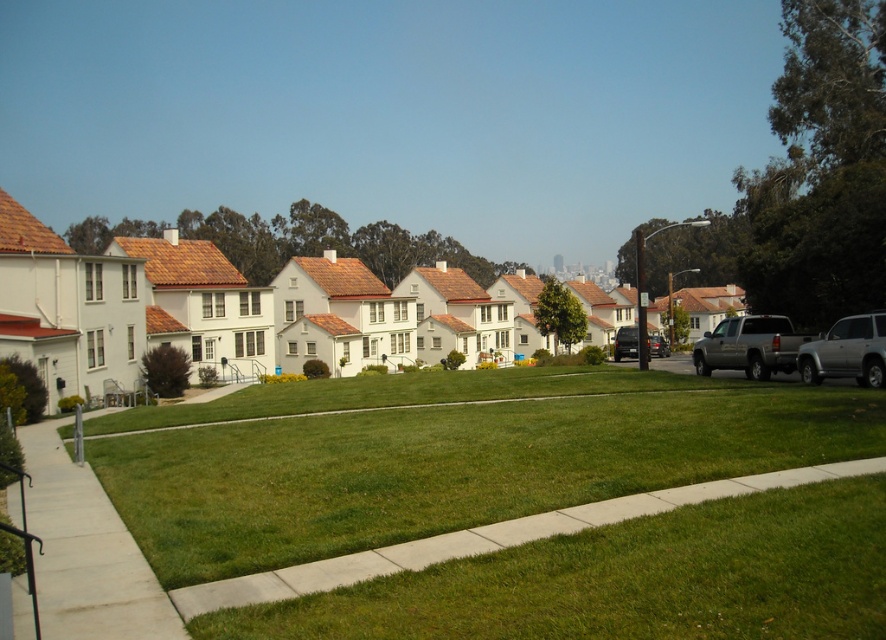
You are standing at the point with coordinates (750, 346) in the image. What object is located at that point?

The point (750, 346) corresponds to the silver metallic truck at right.

You are a delivery person standing on the gray concrete sidewalk at lower left and need to reach the silver metallic truck at right. Which direction should you move to get closer to the truck?

Since the gray concrete sidewalk at lower left is closer to the viewer than the silver metallic truck at right, you should move forward in the direction towards the truck to get closer to it.

You are a delivery driver who needs to park your vehicle in the suburban neighborhood. You see a silver metallic truck at right and a silver metallic suv at right. Which vehicle is positioned higher up in the image?

The silver metallic truck at right is located above the silver metallic suv at right in the image.